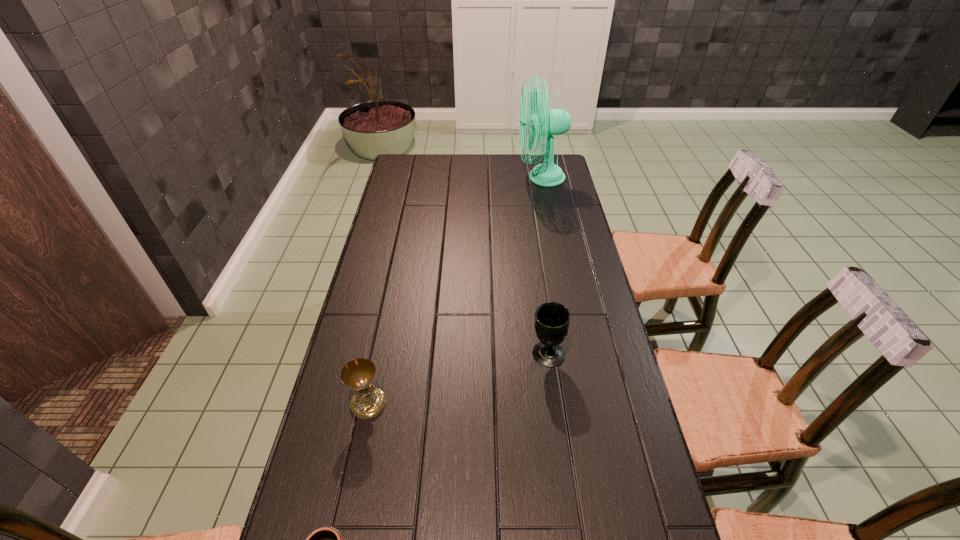
The image size is (960, 540). Identify the location of the farthest object. (549, 122).

Image resolution: width=960 pixels, height=540 pixels. In order to click on fan in this screenshot , I will do `click(549, 122)`.

The height and width of the screenshot is (540, 960). I want to click on the second tallest object, so click(x=552, y=319).

At what (x,y) coordinates should I click in order to perform the action: click on the right chalice. Please return your answer as a coordinate pair (x, y). This screenshot has height=540, width=960. Looking at the image, I should click on pos(552,319).

At what (x,y) coordinates should I click in order to perform the action: click on the left chalice. Please return your answer as a coordinate pair (x, y). Looking at the image, I should click on tap(368, 401).

Locate an element on the screen. Image resolution: width=960 pixels, height=540 pixels. the second shortest object is located at coordinates (368, 401).

Find the location of `vacant space located in front of the farthest object to blow air`. vacant space located in front of the farthest object to blow air is located at coordinates (455, 178).

The image size is (960, 540). I want to click on vacant space located 0.260m in front of the farthest object to blow air, so click(459, 178).

Locate an element on the screen. The image size is (960, 540). vacant area situated 0.060m in front of the farthest object to blow air is located at coordinates (504, 178).

Identify the location of free point located 0.270m on the front of the taller chalice. The height and width of the screenshot is (540, 960). (564, 464).